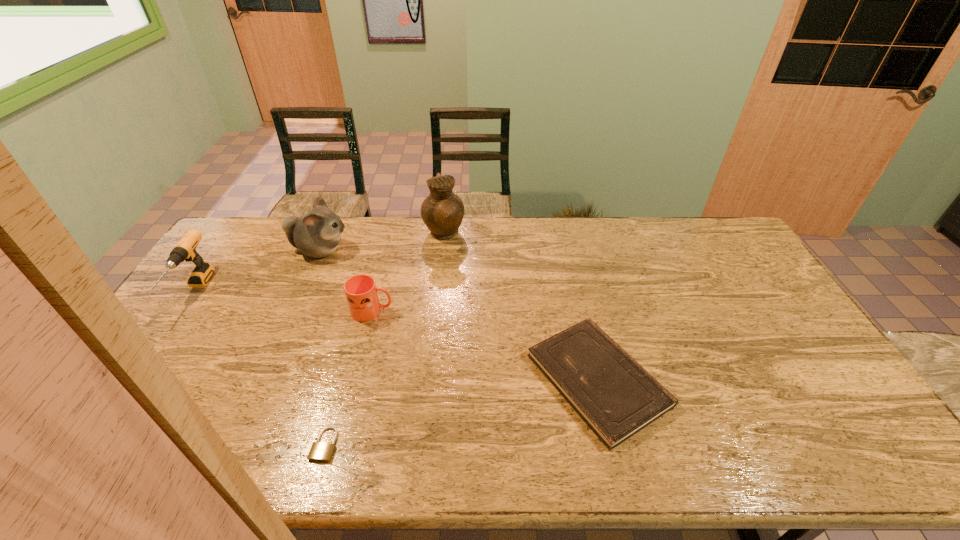
Locate an element on the screen. This screenshot has width=960, height=540. unoccupied area between the fifth shortest object and the shortest object is located at coordinates (323, 347).

Locate an element on the screen. The height and width of the screenshot is (540, 960). vacant space that is in between the mug and the paperback book is located at coordinates pyautogui.click(x=485, y=346).

You are a GUI agent. You are given a task and a screenshot of the screen. Output one action in this format:
    pyautogui.click(x=<x>, y=<y>)
    Task: Click on the vacant point located between the mug and the hamster
    The image size is (960, 540).
    Given the screenshot: What is the action you would take?
    pyautogui.click(x=347, y=281)

Identify the location of vacant region between the leftmost object and the padlock. (259, 368).

Where is `free space between the tallest object and the second shortest object`? The height and width of the screenshot is (540, 960). free space between the tallest object and the second shortest object is located at coordinates (520, 307).

This screenshot has width=960, height=540. What are the coordinates of `vacant space in between the fifth object from right to left and the pitcher` in the screenshot? It's located at [382, 242].

Locate an element on the screen. This screenshot has width=960, height=540. object identified as the second closest to the mug is located at coordinates (442, 212).

The height and width of the screenshot is (540, 960). Find the location of `object that is the fifth closest to the pitcher`. object that is the fifth closest to the pitcher is located at coordinates (320, 451).

The image size is (960, 540). I want to click on free location that satisfies the following two spatial constraints: 1. on the face of the rightmost object; 2. on the left side of the fifth shortest object, so click(x=264, y=380).

Locate an element on the screen. Image resolution: width=960 pixels, height=540 pixels. vacant space that satisfies the following two spatial constraints: 1. on the handle side of the fourth tallest object; 2. on the right side of the paperback book is located at coordinates (355, 380).